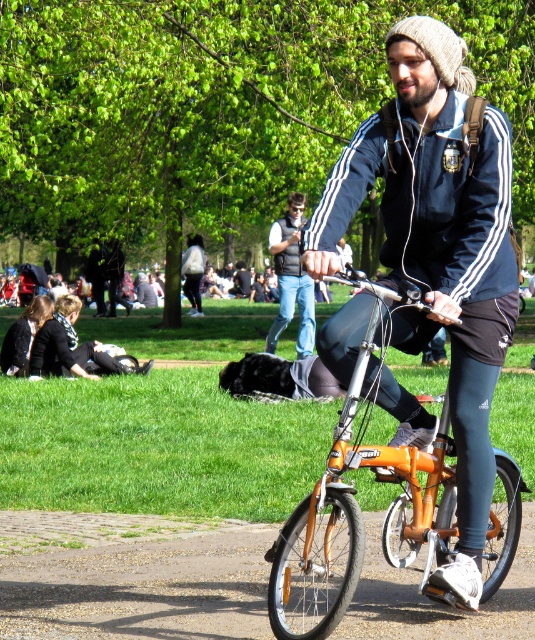
Question: Does black fabric jacket at lower left have a greater width compared to black fabric bag at center?

Choices:
 (A) no
 (B) yes

Answer: (B)

Question: Among these objects, which one is farthest from the camera?

Choices:
 (A) black fabric bag at center
 (B) orange metallic bicycle at center
 (C) black fabric jacket at lower left

Answer: (A)

Question: Which object is farther from the camera taking this photo?

Choices:
 (A) orange metallic bicycle at center
 (B) denim jeans at center

Answer: (B)

Question: Which point is farther to the camera?

Choices:
 (A) orange metallic bicycle at center
 (B) black fabric jacket at lower left
 (C) denim jeans at center
 (D) black fabric bag at center

Answer: (D)

Question: Does orange metallic bicycle at center have a smaller size compared to black fabric bag at center?

Choices:
 (A) yes
 (B) no

Answer: (B)

Question: Can you confirm if orange metallic bicycle at center is positioned to the right of denim jeans at center?

Choices:
 (A) no
 (B) yes

Answer: (B)